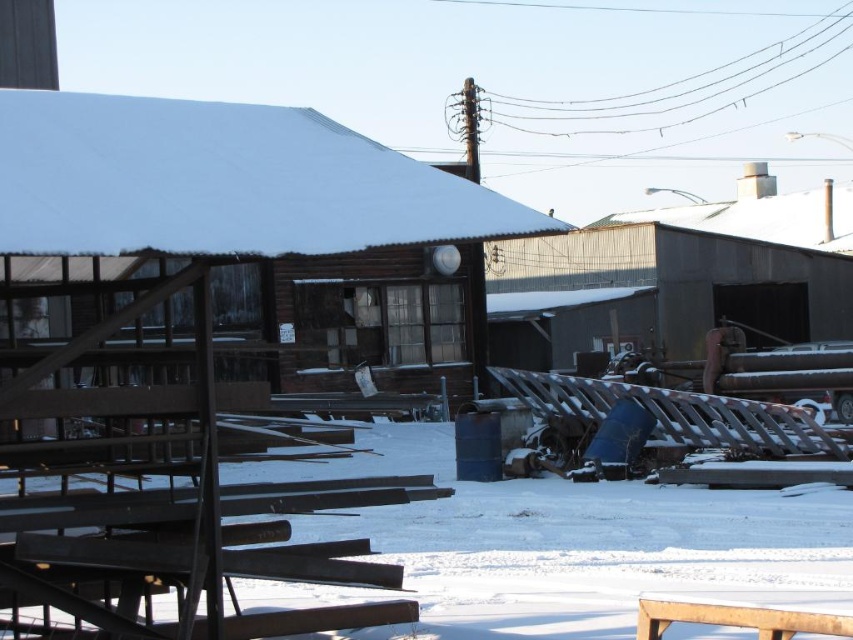
Is white powdery snow at center taller than brown wooden hut at center?

Yes.

Consider the image. Does white powdery snow at center have a lesser width compared to brown wooden hut at center?

In fact, white powdery snow at center might be wider than brown wooden hut at center.

Between point (561, 541) and point (270, 144), which one is positioned in front?

Point (270, 144) is more forward.

Identify the location of white powdery snow at center. (558, 544).